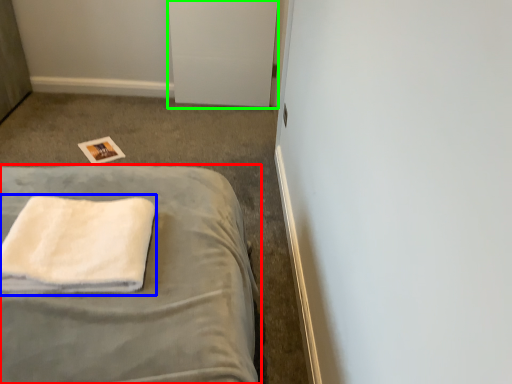
Question: Which object is the farthest from bed (highlighted by a red box)? Choose among these: towel (highlighted by a blue box) or file cabinet (highlighted by a green box).

Choices:
 (A) towel
 (B) file cabinet

Answer: (B)